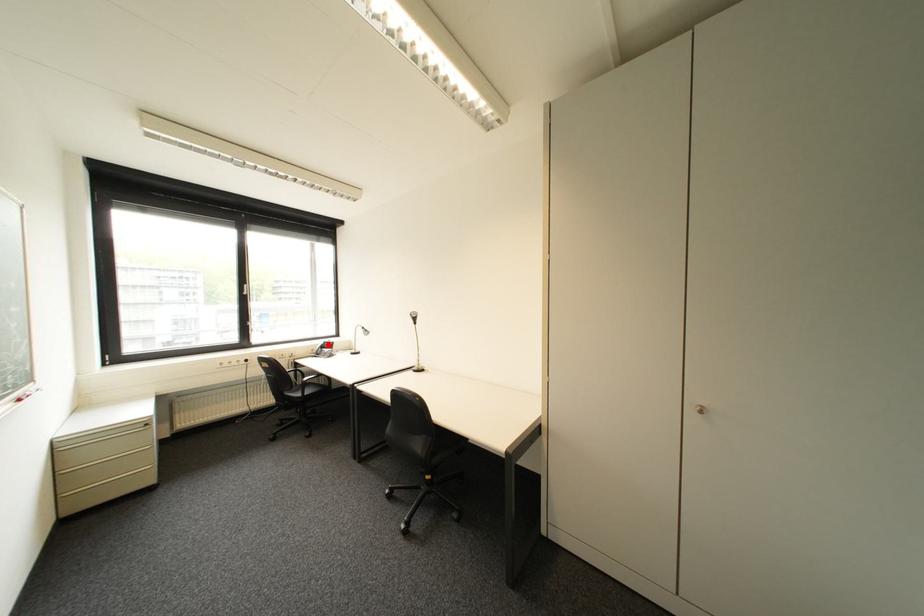
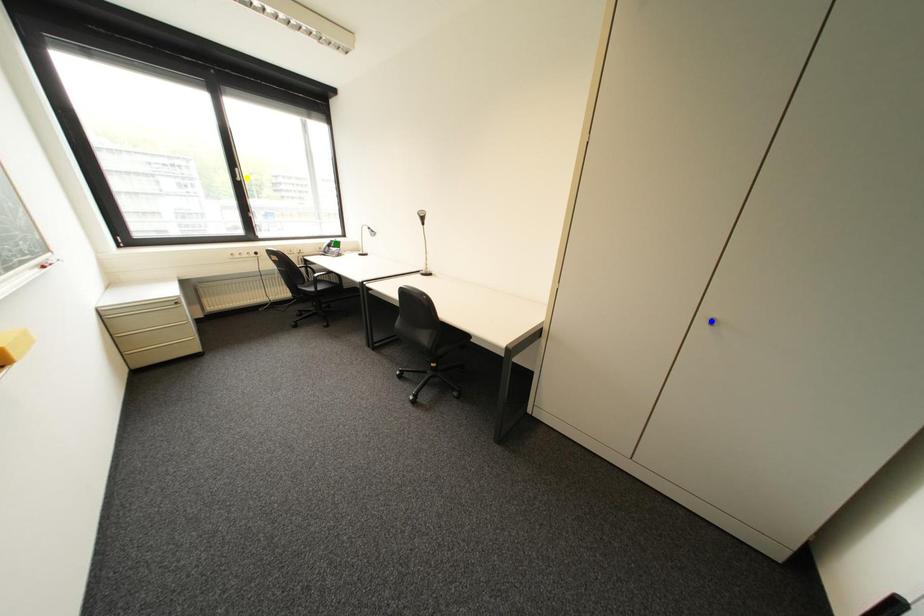
Question: I am providing you with two images of the same scene from different viewpoints. A red point is marked on the first image. You are given multiple points on the second image. Which point in image 2 is actually the same real-world point as the red point in image 1?

Choices:
 (A) yellow point
 (B) green point
 (C) blue point

Answer: (B)